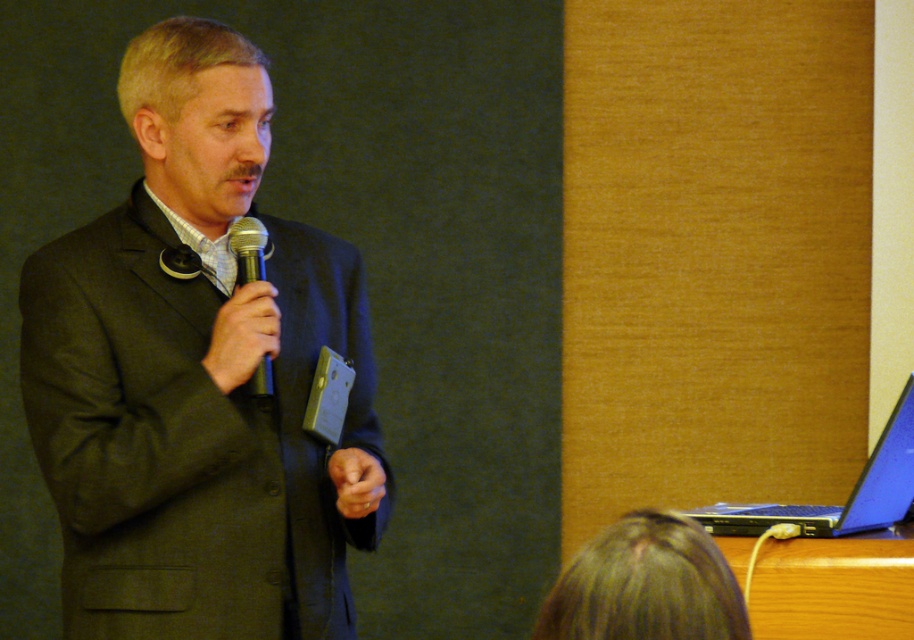
Question: Which point appears farthest from the camera in this image?

Choices:
 (A) (105, 355)
 (B) (753, 518)
 (C) (259, 268)

Answer: (B)

Question: Can you confirm if dark gray suit at center is bigger than blue glossy laptop at lower right?

Choices:
 (A) yes
 (B) no

Answer: (A)

Question: Considering the relative positions of dark gray suit at center and blue glossy laptop at lower right in the image provided, where is dark gray suit at center located with respect to blue glossy laptop at lower right?

Choices:
 (A) right
 (B) left

Answer: (B)

Question: Does blue glossy laptop at lower right appear on the right side of black matte microphone at center?

Choices:
 (A) no
 (B) yes

Answer: (B)

Question: Which point is farther to the camera?

Choices:
 (A) dark gray suit at center
 (B) black matte microphone at center
 (C) blue glossy laptop at lower right

Answer: (C)

Question: Which object is farther from the camera taking this photo?

Choices:
 (A) blue glossy laptop at lower right
 (B) black matte microphone at center
 (C) dark gray suit at center

Answer: (A)